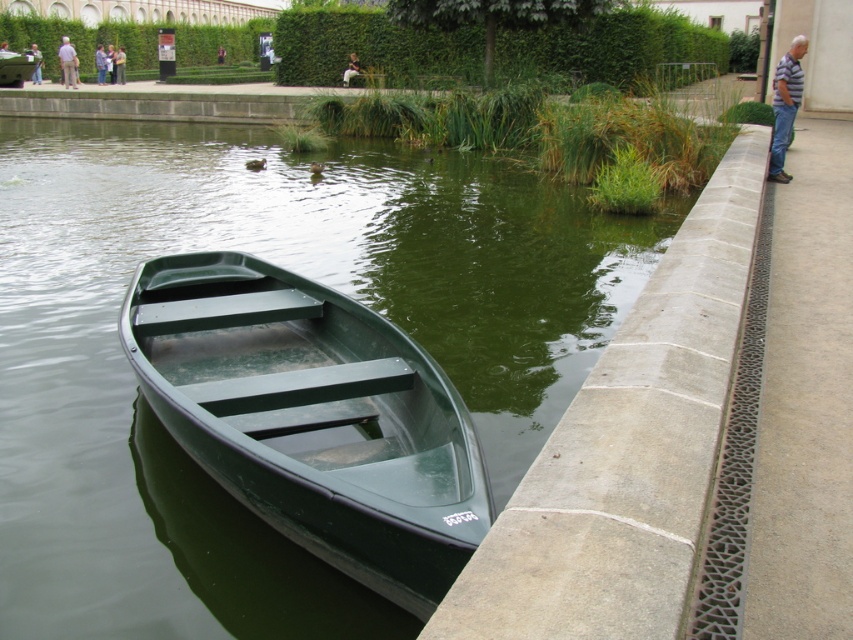
Question: Which of the following is the farthest from the observer?

Choices:
 (A) (102, 60)
 (B) (785, 83)

Answer: (A)

Question: Which point is farther from the camera taking this photo?

Choices:
 (A) (41, 228)
 (B) (772, 81)

Answer: (B)

Question: Is striped shirt at right wider than light blue shirt at upper left?

Choices:
 (A) yes
 (B) no

Answer: (B)

Question: Does gray fabric jacket at upper left lie behind light blue shirt at upper left?

Choices:
 (A) no
 (B) yes

Answer: (A)

Question: Does green plastic boat at lower left have a larger size compared to light blue shirt at upper left?

Choices:
 (A) no
 (B) yes

Answer: (B)

Question: Which object appears closest to the camera in this image?

Choices:
 (A) gray fabric jacket at upper left
 (B) green plastic boat at lower left
 (C) light blue shirt at upper left

Answer: (B)